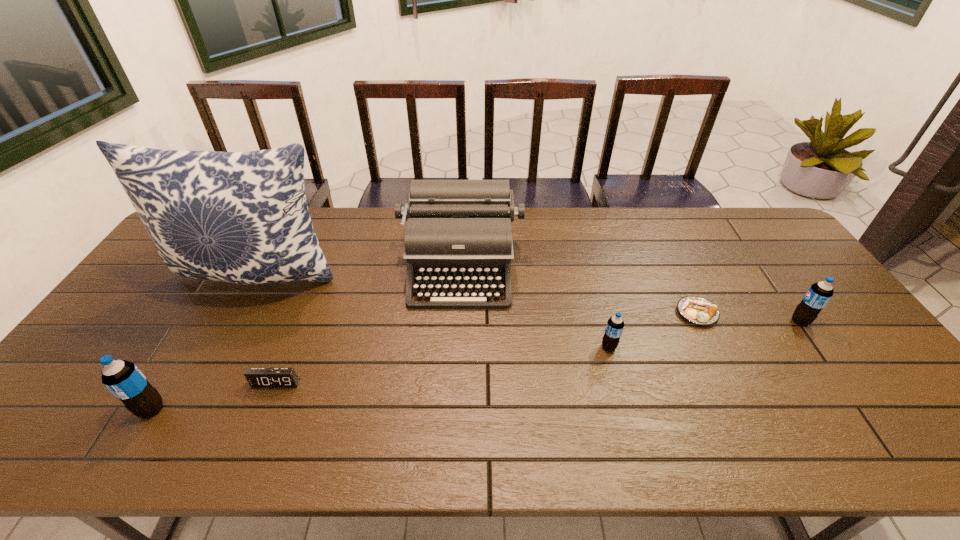
In order to click on vacant area that lies between the alarm clock and the cushion in this screenshot , I will do `click(267, 330)`.

You are a GUI agent. You are given a task and a screenshot of the screen. Output one action in this format:
    pyautogui.click(x=<x>, y=<y>)
    Task: Click on the free area in between the shortest object and the fourth object from right to left
    
    Given the screenshot: What is the action you would take?
    pyautogui.click(x=579, y=291)

Locate an element on the screen. free space between the pastry and the alarm clock is located at coordinates [x=487, y=348].

You are a GUI agent. You are given a task and a screenshot of the screen. Output one action in this format:
    pyautogui.click(x=<x>, y=<y>)
    Task: Click on the free space between the typewriter and the tallest object
    The width and height of the screenshot is (960, 540).
    Given the screenshot: What is the action you would take?
    pyautogui.click(x=359, y=273)

Find the location of a particular element. The image size is (960, 540). free space between the typewriter and the second object from right to left is located at coordinates (579, 291).

Where is `vacant region between the sixth farthest object and the fifth object from left to right`? The height and width of the screenshot is (540, 960). vacant region between the sixth farthest object and the fifth object from left to right is located at coordinates pyautogui.click(x=443, y=365).

Identify the location of the third closest object to the pastry. This screenshot has height=540, width=960. (458, 231).

Locate which object is the sixth closest to the cushion. Please provide its 2D coordinates. Your answer should be formatted as a tuple, i.e. [(x, y)], where the tuple contains the x and y coordinates of a point satisfying the conditions above.

[(819, 294)]

The height and width of the screenshot is (540, 960). I want to click on soda bottle identified as the closest to the fourth object from left to right, so click(x=615, y=325).

The width and height of the screenshot is (960, 540). Identify the location of soda bottle that is the second closest one to the fourth object from right to left. (123, 379).